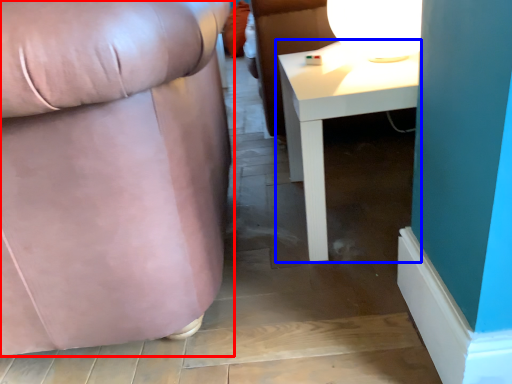
Question: Which object appears closest to the camera in this image, chair (highlighted by a red box) or table (highlighted by a blue box)?

Choices:
 (A) chair
 (B) table

Answer: (A)